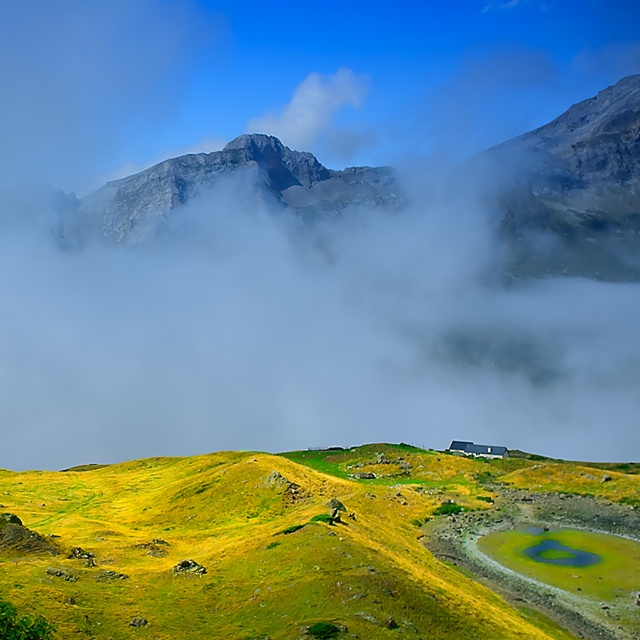
Is point (65, 563) farther from viewer compared to point (272, 129)?

No, it is not.

Does green grassy hillside at center appear on the left side of white fluffy cloud at upper center?

Incorrect, green grassy hillside at center is not on the left side of white fluffy cloud at upper center.

Does point (598, 493) come in front of point (301, 104)?

Yes, it is.

At what (x,y) coordinates should I click in order to perform the action: click on green grassy hillside at center. Please return your answer as a coordinate pair (x, y). The height and width of the screenshot is (640, 640). Looking at the image, I should click on (266, 544).

Between point (289, 28) and point (364, 90), which one is positioned in front?

Point (364, 90) is more forward.

Is point (212, 60) farther from viewer compared to point (310, 93)?

That is True.

Where is `white mist at upper center`? white mist at upper center is located at coordinates (296, 237).

Who is shorter, white mist at upper center or green grassy hillside at center?

green grassy hillside at center

Between white mist at upper center and green grassy hillside at center, which one is positioned higher?

white mist at upper center is above.

Who is more distant from viewer, (26, 109) or (96, 579)?

Positioned behind is point (26, 109).

This screenshot has width=640, height=640. I want to click on white mist at upper center, so click(x=296, y=237).